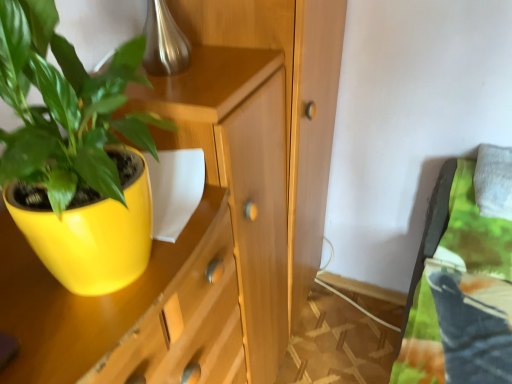
Question: Does white fabric pillow at upper right have a lesser width compared to wooden dresser at center?

Choices:
 (A) yes
 (B) no

Answer: (A)

Question: Is white fabric pillow at upper right facing towards wooden dresser at center?

Choices:
 (A) no
 (B) yes

Answer: (A)

Question: Does white fabric pillow at upper right have a lesser height compared to wooden dresser at center?

Choices:
 (A) yes
 (B) no

Answer: (A)

Question: Could wooden dresser at center be considered to be inside white fabric pillow at upper right?

Choices:
 (A) yes
 (B) no

Answer: (B)

Question: From a real-world perspective, is white fabric pillow at upper right over wooden dresser at center?

Choices:
 (A) no
 (B) yes

Answer: (B)

Question: Is white fabric pillow at upper right bigger or smaller than matte wood cabinet at center?

Choices:
 (A) big
 (B) small

Answer: (B)

Question: From a real-world perspective, is white fabric pillow at upper right above or below matte wood cabinet at center?

Choices:
 (A) above
 (B) below

Answer: (A)

Question: Looking at their shapes, would you say white fabric pillow at upper right is wider or thinner than matte wood cabinet at center?

Choices:
 (A) thin
 (B) wide

Answer: (A)

Question: Is white fabric pillow at upper right in front of or behind matte wood cabinet at center in the image?

Choices:
 (A) behind
 (B) front

Answer: (A)

Question: Considering the positions of point (504, 195) and point (315, 190), is point (504, 195) closer or farther from the camera than point (315, 190)?

Choices:
 (A) closer
 (B) farther

Answer: (A)

Question: From a real-world perspective, is white fabric pillow at upper right physically located above or below wooden dresser at center?

Choices:
 (A) above
 (B) below

Answer: (A)

Question: Looking at their shapes, would you say white fabric pillow at upper right is wider or thinner than wooden dresser at center?

Choices:
 (A) thin
 (B) wide

Answer: (A)

Question: Is white fabric pillow at upper right in front of or behind wooden dresser at center in the image?

Choices:
 (A) front
 (B) behind

Answer: (B)

Question: In terms of height, does matte yellow pot at left look taller or shorter compared to matte wood cabinet at center?

Choices:
 (A) tall
 (B) short

Answer: (B)

Question: Is matte yellow pot at left inside or outside of matte wood cabinet at center?

Choices:
 (A) inside
 (B) outside

Answer: (A)